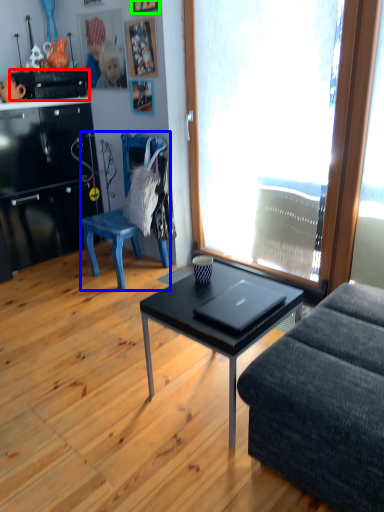
Question: Estimate the real-world distances between objects in this image. Which object is farther from appliance (highlighted by a red box), chair (highlighted by a blue box) or picture frame (highlighted by a green box)?

Choices:
 (A) chair
 (B) picture frame

Answer: (A)